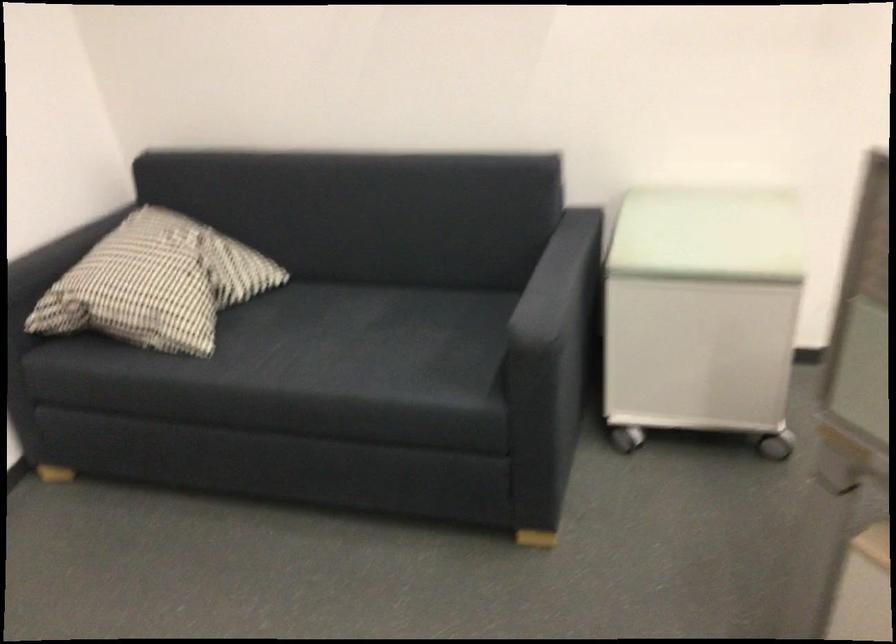
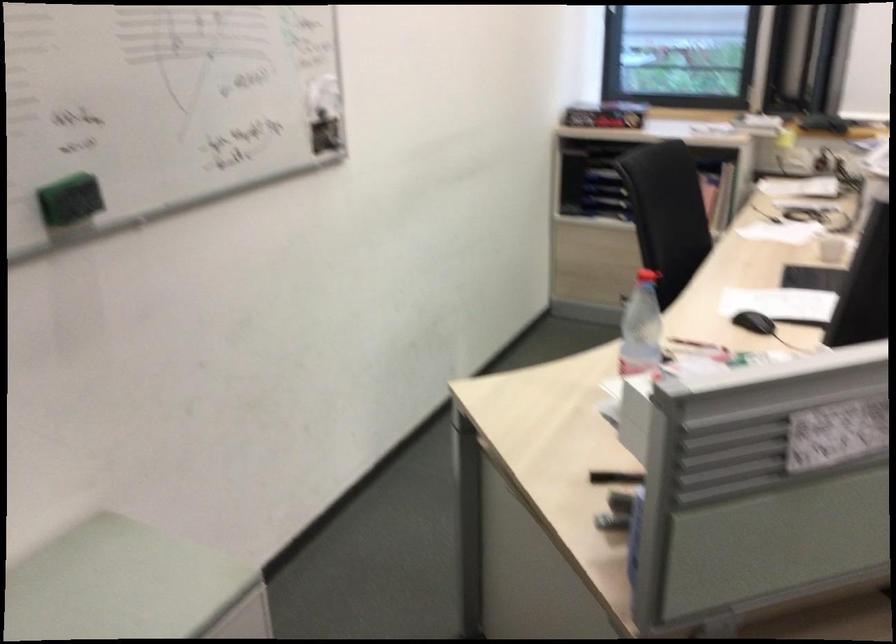
Question: The camera is either moving clockwise (left) or counter-clockwise (right) around the object. The first image is from the beginning of the video and the second image is from the end. Is the camera moving left or right when shooting the video?

Choices:
 (A) Left
 (B) Right

Answer: (A)